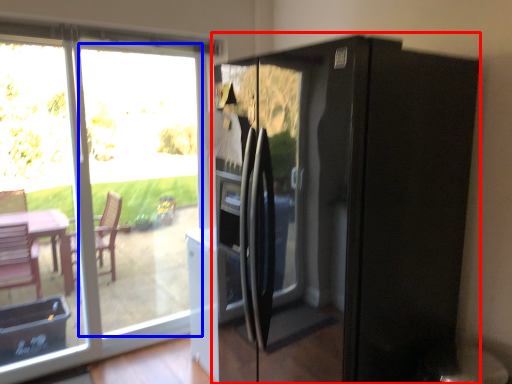
Question: Which point is closer to the camera, appliance (highlighted by a red box) or glass door (highlighted by a blue box)?

Choices:
 (A) appliance
 (B) glass door

Answer: (A)